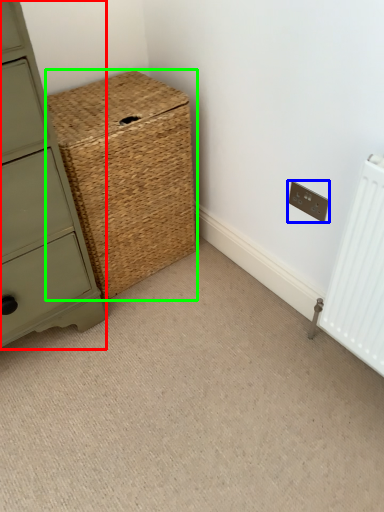
Question: Which object is the closest to the chest of drawers (highlighted by a red box)? Choose among these: electric outlet (highlighted by a blue box) or basket (highlighted by a green box).

Choices:
 (A) electric outlet
 (B) basket

Answer: (B)